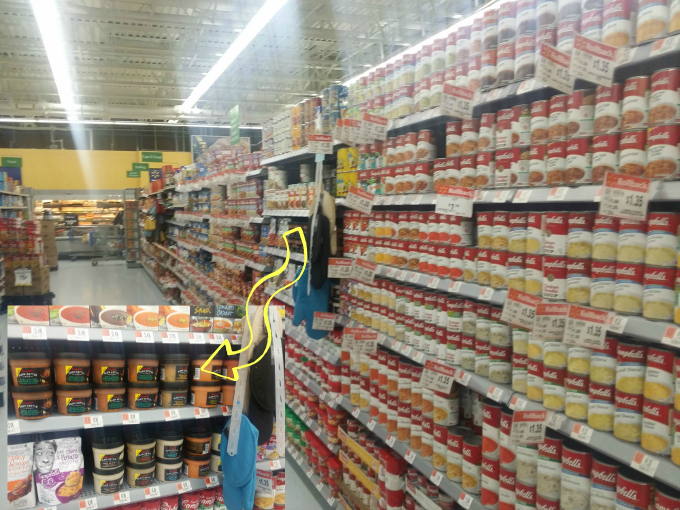
Identify the location of lights. This screenshot has height=510, width=680. (239, 38), (52, 41).